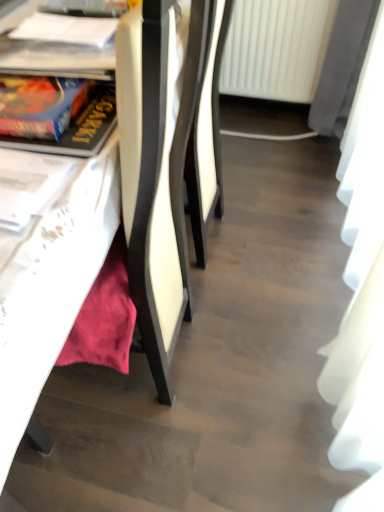
Question: Is point (26, 24) positioned closer to the camera than point (354, 269)?

Choices:
 (A) closer
 (B) farther

Answer: (A)

Question: Based on their positions, is white paper at upper left, the first book from the back, located to the left or right of white fabric curtain at right?

Choices:
 (A) left
 (B) right

Answer: (A)

Question: Which object is the closest to the blue cardboard book at left, arranged as the first book when viewed from the front?

Choices:
 (A) white paper at upper left, which is the 2th book from front to back
 (B) white plastic radiator at upper center
 (C) white fabric curtain at right
 (D) matte white table at lower left

Answer: (D)

Question: Estimate the real-world distances between objects in this image. Which object is farther from the blue cardboard book at left, which is counted as the 1th book, starting from the bottom?

Choices:
 (A) white fabric curtain at right
 (B) white plastic radiator at upper center
 (C) white paper at upper left, which is the 2th book from front to back
 (D) matte white table at lower left

Answer: (B)